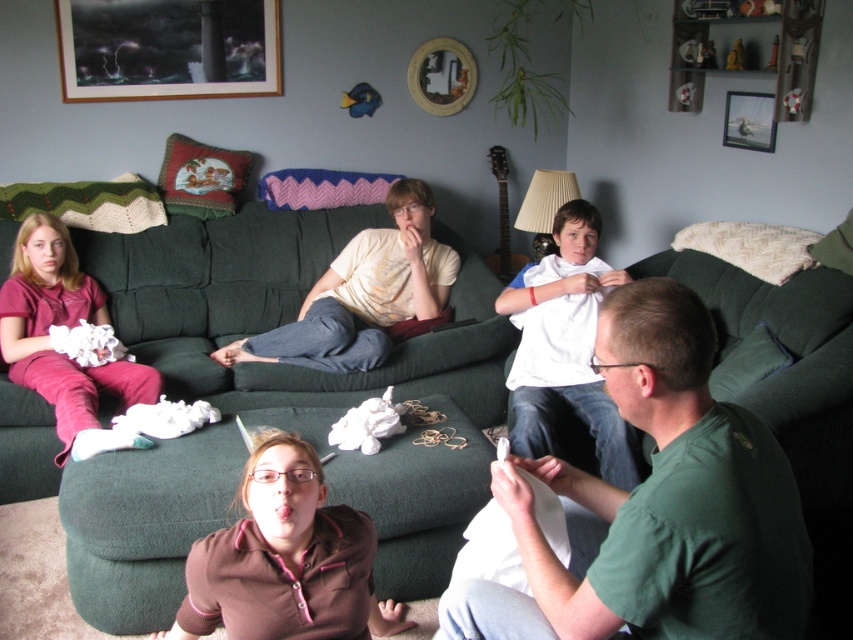
You are a photographer trying to capture a candid shot of the green matte shirt at lower right and the brown fleece at center. Since you want to ensure both are clearly visible, which clothing item should you focus on first to avoid blurring due to size differences?

You should focus on the green matte shirt at lower right first because it is smaller in size compared to the brown fleece at center, making it harder to capture details clearly if not prioritized.

What object is located at the coordinate point (167, 49) in the image?

The wooden framed artwork at upper left is located at the coordinate point (167, 49).

You are a photographer trying to capture a candid shot of the brown fleece at center and the green matte shirt at lower right. Which object should you focus on first if you want to ensure both are in sharp focus?

You should focus on the green matte shirt at lower right first because it is closer to the viewer than the brown fleece at center, so focusing on the closer object will help ensure both are in focus.